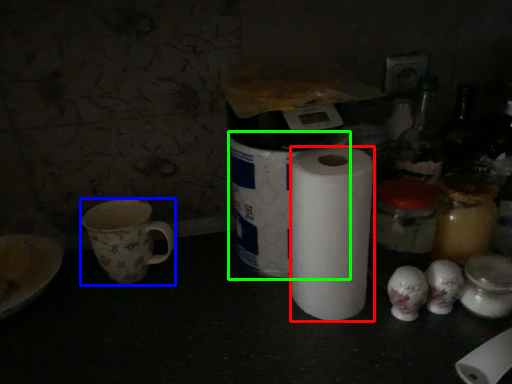
Question: Estimate the real-world distances between objects in this image. Which object is closer to paper towel (highlighted by a red box), coffee cup (highlighted by a blue box) or toilet paper (highlighted by a green box)?

Choices:
 (A) coffee cup
 (B) toilet paper

Answer: (B)